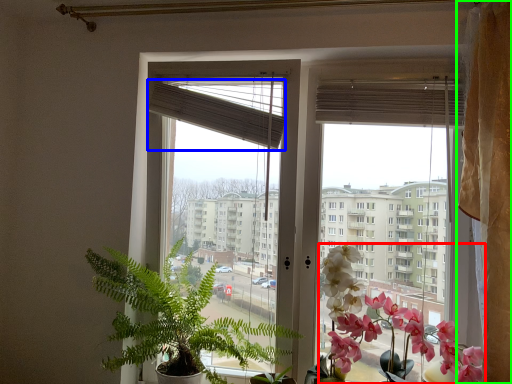
Question: Considering the real-world distances, which object is farthest from flower (highlighted by a red box)? blind (highlighted by a blue box) or curtain (highlighted by a green box)?

Choices:
 (A) blind
 (B) curtain

Answer: (A)